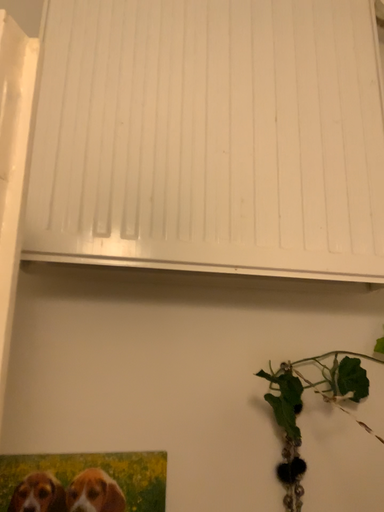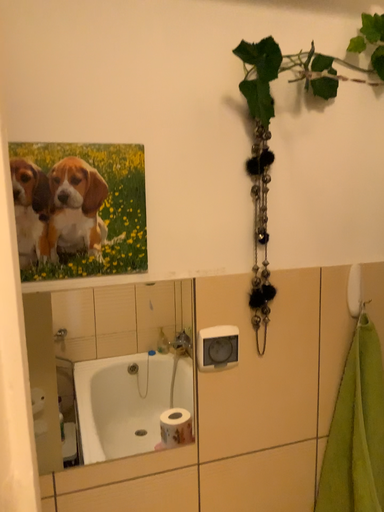
Question: How did the camera likely rotate when shooting the video?

Choices:
 (A) rotated upward
 (B) rotated downward

Answer: (B)